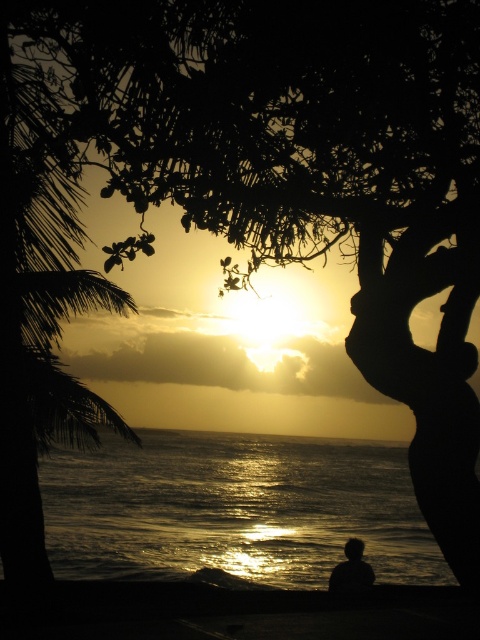
Question: Can you confirm if silky black palm tree at left is thinner than silhouette figure at center?

Choices:
 (A) no
 (B) yes

Answer: (B)

Question: Is silky black palm tree at left further to the viewer compared to silhouette figure at center?

Choices:
 (A) no
 (B) yes

Answer: (A)

Question: Is the position of silky black palm tree at left more distant than that of silhouette figure at center?

Choices:
 (A) no
 (B) yes

Answer: (A)

Question: Among these points, which one is farthest from the camera?

Choices:
 (A) pos(360,554)
 (B) pos(7,220)

Answer: (A)

Question: Which point appears farthest from the camera in this image?

Choices:
 (A) (360, 557)
 (B) (58, 108)

Answer: (A)